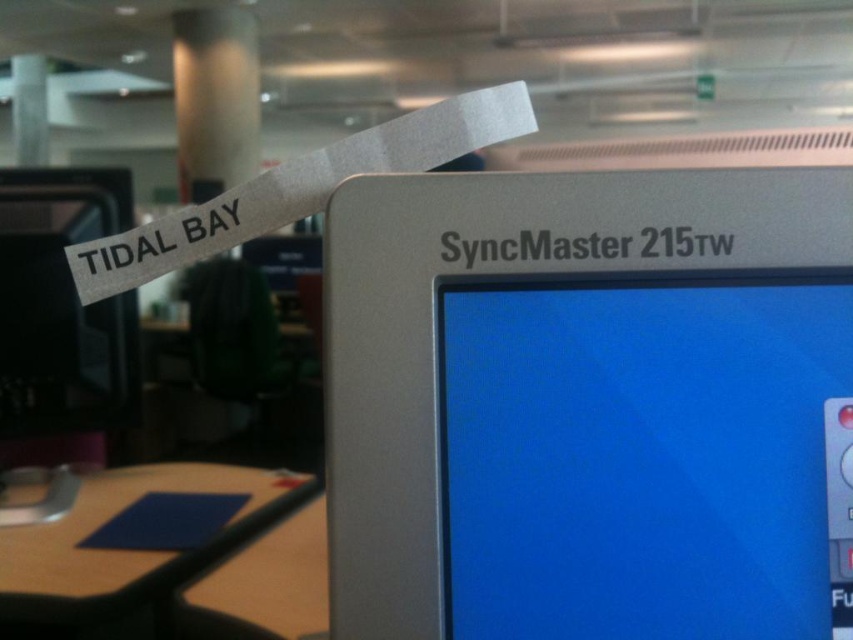
You are organizing a tech exhibition and need to arrange two monitors on a shelf. The shelf has limited vertical space. Given the silver metallic monitor at center and the matte black monitor at left, which monitor should you place first to ensure both fit vertically?

The silver metallic monitor at center is shorter than the matte black monitor at left, so you should place the matte black monitor at left first to accommodate its greater height, allowing both monitors to fit vertically on the shelf.

You are an office worker who needs to place a 12 inch wide laptop between the silver metallic monitor at center and the matte black monitor at left. Can the laptop fit between them?

The silver metallic monitor at center and the matte black monitor at left are 11.76 inches apart, so the 12 inch wide laptop cannot fit between them as the space is slightly narrower than the laptop.

You are organizing an office space and need to know if the matte black monitor at left can be placed on the blue matte table at lower left without overhanging. Based on the scene description, is the monitor currently positioned on the table?

The matte black monitor at left is positioned over blue matte table at lower left, so yes, it is currently placed on the table and does not overhang since it is already positioned over it.